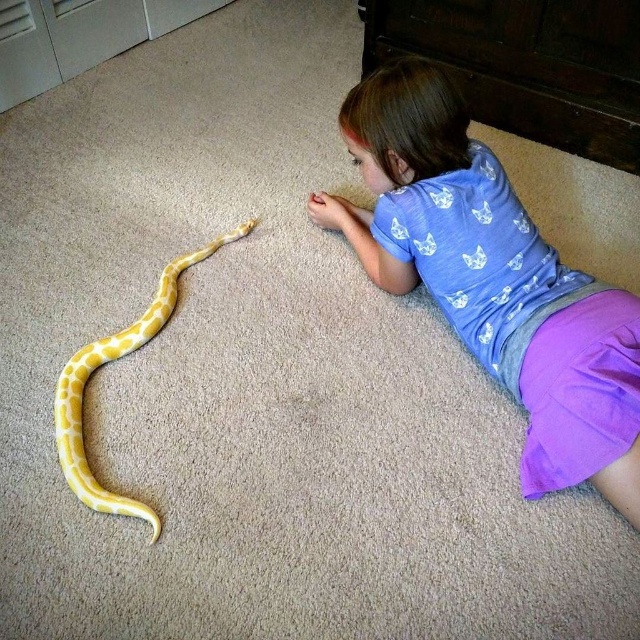
In the scene shown: The girl is trying to decide whether her purple cotton shorts at lower right can fully cover the yellow matte snake at center if she places it on top. Based on their sizes, what would you advise?

The purple cotton shorts at lower right has a larger size compared to the yellow matte snake at center, so it can fully cover the snake when placed on top.

You are a photographer taking a picture of the girl and the snake. The snake is at point (492, 280). Where is the snake located in relation to the girl?

The snake is located on the purple cotton shorts at lower right, which is part of the girl, so the snake is near the girl.

The young girl is trying to decide if her purple cotton shorts at lower right can fit over the yellow matte snake at center. Based on their widths, can the shorts completely cover the snake when placed directly on top?

The purple cotton shorts at lower right are wider than the yellow matte snake at center, so they can completely cover the snake when placed directly on top.